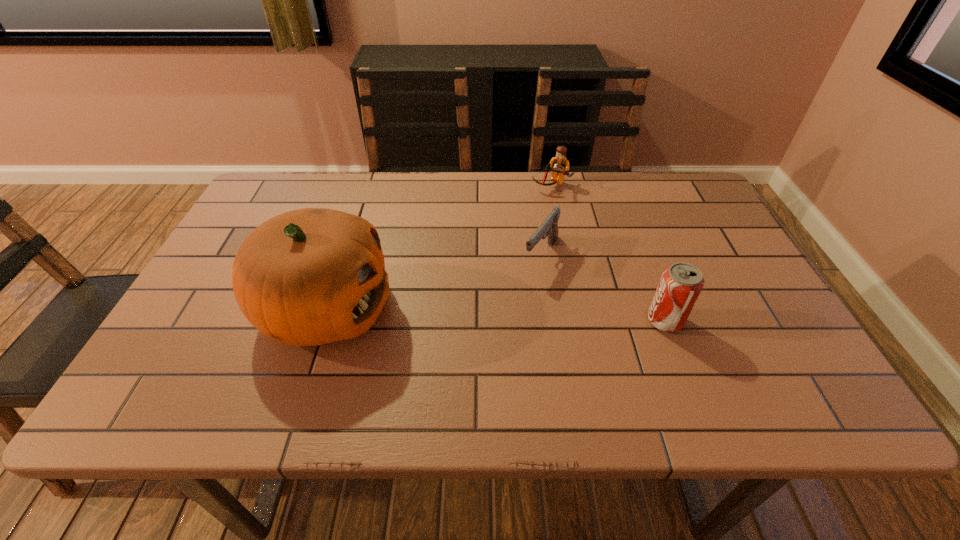
This screenshot has width=960, height=540. I want to click on vacant space at the left edge of the desktop, so click(x=213, y=299).

Where is `vacant point at the right edge`? Image resolution: width=960 pixels, height=540 pixels. vacant point at the right edge is located at coordinates 759,312.

In the image, there is a desktop. Identify the location of free space at the far right corner. Image resolution: width=960 pixels, height=540 pixels. (681, 199).

Identify the location of vacant area that lies between the rightmost object and the Lego. This screenshot has height=540, width=960. (609, 253).

You are a GUI agent. You are given a task and a screenshot of the screen. Output one action in this format:
    pyautogui.click(x=<x>, y=<y>)
    Task: Click on the free spot between the pumpkin and the farthest object
    The width and height of the screenshot is (960, 540).
    Given the screenshot: What is the action you would take?
    pyautogui.click(x=439, y=247)

Find the location of `free spot between the pistol and the rightmost object`. free spot between the pistol and the rightmost object is located at coordinates (603, 288).

Where is `free space that is in between the rightmost object and the pistol`? The height and width of the screenshot is (540, 960). free space that is in between the rightmost object and the pistol is located at coordinates (603, 288).

At what (x,y) coordinates should I click in order to perform the action: click on free point between the pistol and the leftmost object. Please return your answer as a coordinate pair (x, y). Looking at the image, I should click on (434, 282).

The height and width of the screenshot is (540, 960). I want to click on vacant space in between the rightmost object and the pistol, so click(603, 288).

The width and height of the screenshot is (960, 540). In order to click on free space between the pumpkin and the Lego in this screenshot , I will do `click(439, 247)`.